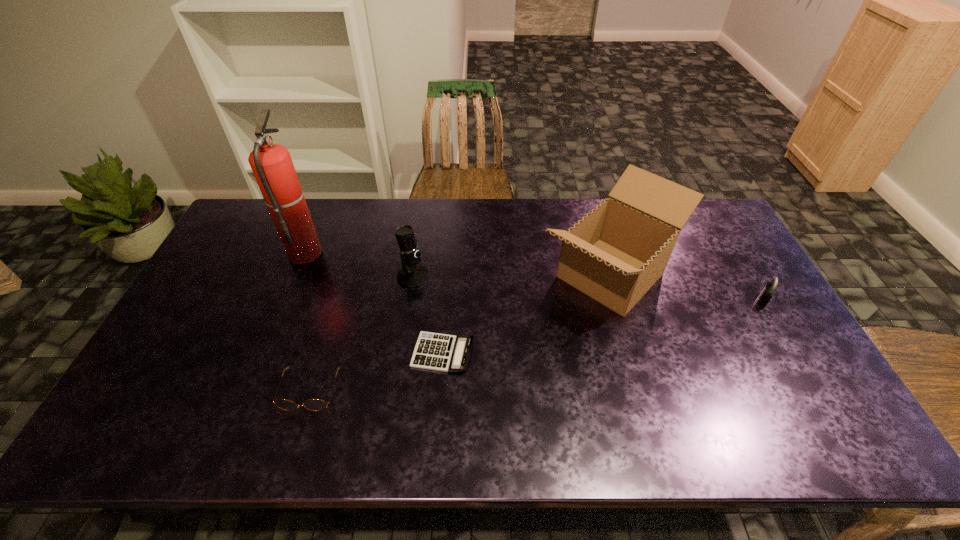
Where is `vacant area in the image that satisfies the following two spatial constraints: 1. on the front side of the microphone; 2. on the left side of the rightmost object`? Image resolution: width=960 pixels, height=540 pixels. vacant area in the image that satisfies the following two spatial constraints: 1. on the front side of the microphone; 2. on the left side of the rightmost object is located at coordinates (410, 300).

Image resolution: width=960 pixels, height=540 pixels. What are the coordinates of `vacant space that satisfies the following two spatial constraints: 1. with the nozzle and gauge on the third tallest object; 2. on the left side of the leftmost object` in the screenshot? It's located at (295, 276).